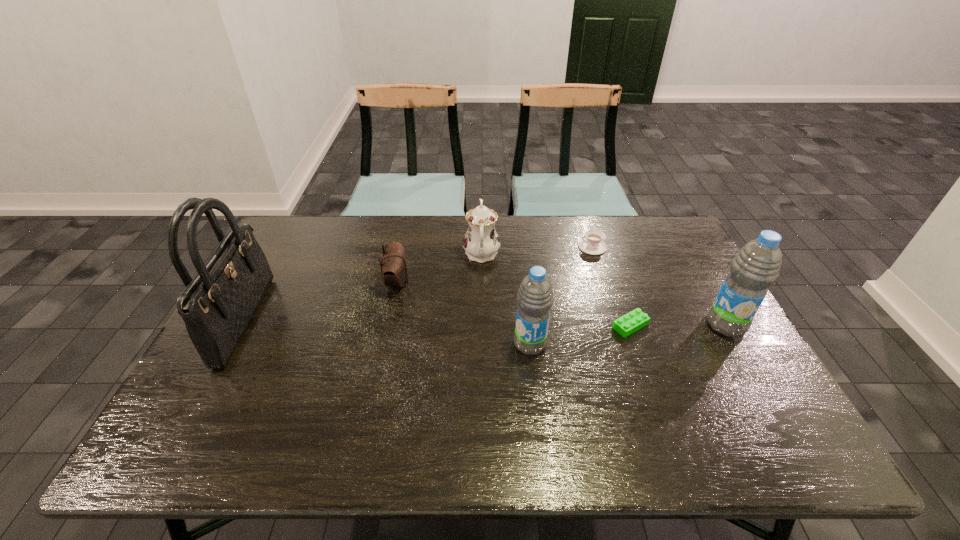
Find the location of a particular element. This screenshot has height=540, width=960. the third tallest object is located at coordinates (535, 297).

In order to click on the left water bottle in this screenshot , I will do `click(535, 297)`.

I want to click on the taller water bottle, so click(x=756, y=266).

You are a GUI agent. You are given a task and a screenshot of the screen. Output one action in this format:
    pyautogui.click(x=<x>, y=<y>)
    Task: Click on the right water bottle
    Image resolution: width=960 pixels, height=540 pixels.
    Given the screenshot: What is the action you would take?
    pyautogui.click(x=756, y=266)

Where is `chinaware`? The width and height of the screenshot is (960, 540). chinaware is located at coordinates (481, 242).

Where is `the fourth shortest object`? The width and height of the screenshot is (960, 540). the fourth shortest object is located at coordinates (481, 242).

The height and width of the screenshot is (540, 960). I want to click on the third shortest object, so click(393, 266).

Locate an element on the screen. This screenshot has height=540, width=960. the sixth object from right to left is located at coordinates (393, 266).

In order to click on teacup in this screenshot , I will do `click(591, 243)`.

Locate an element on the screen. The image size is (960, 540). handbag is located at coordinates (217, 305).